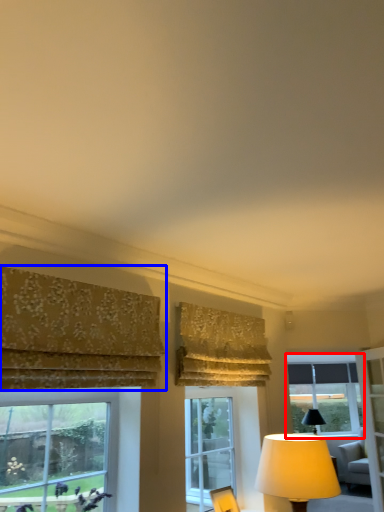
Question: Which of the following is the closest to the observer, window (highlighted by a red box) or curtain (highlighted by a blue box)?

Choices:
 (A) window
 (B) curtain

Answer: (B)